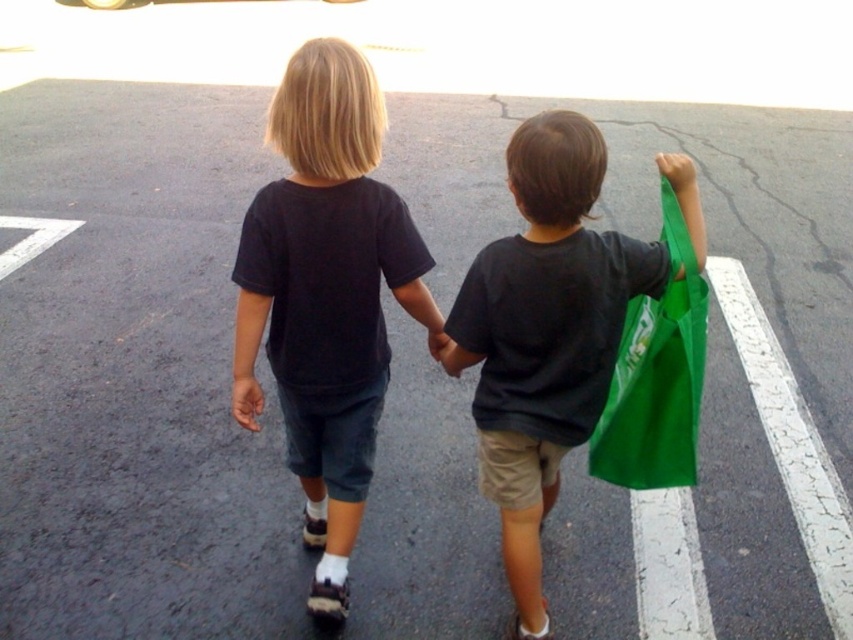
Does green fabric bag at right have a greater height compared to matte skin hand at center?

Indeed, green fabric bag at right has a greater height compared to matte skin hand at center.

Which of these two, green fabric bag at right or matte skin hand at center, stands shorter?

With less height is matte skin hand at center.

Identify the location of green fabric bag at right. The height and width of the screenshot is (640, 853). (657, 374).

Which is behind, point (561, 404) or point (241, 380)?

The point (241, 380) is more distant.

Does green matte bag at right appear over matte skin hand at center?

Incorrect, green matte bag at right is not positioned above matte skin hand at center.

Does point (564, 176) lie in front of point (251, 426)?

Yes, point (564, 176) is in front of point (251, 426).

The height and width of the screenshot is (640, 853). In order to click on green matte bag at right in this screenshot , I will do `click(544, 333)`.

Is the position of black cotton shirt at center less distant than that of green matte bag at right?

No, it is behind green matte bag at right.

Which of these two, black cotton shirt at center or green matte bag at right, stands shorter?

Standing shorter between the two is green matte bag at right.

Does point (329, 140) lie in front of point (537, 380)?

Yes, it is.

Where is `black cotton shirt at center`? This screenshot has height=640, width=853. black cotton shirt at center is located at coordinates (328, 292).